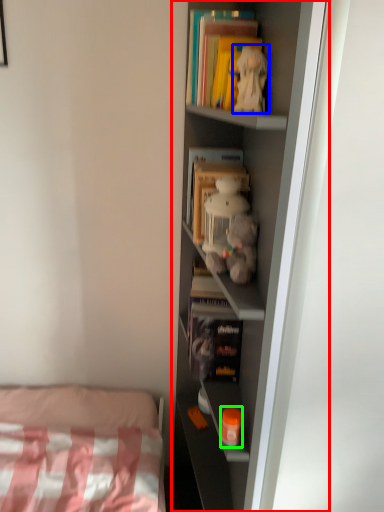
Question: Considering the real-world distances, which object is farthest from shelf (highlighted by a red box)? toy (highlighted by a blue box) or toy (highlighted by a green box)?

Choices:
 (A) toy
 (B) toy

Answer: (B)